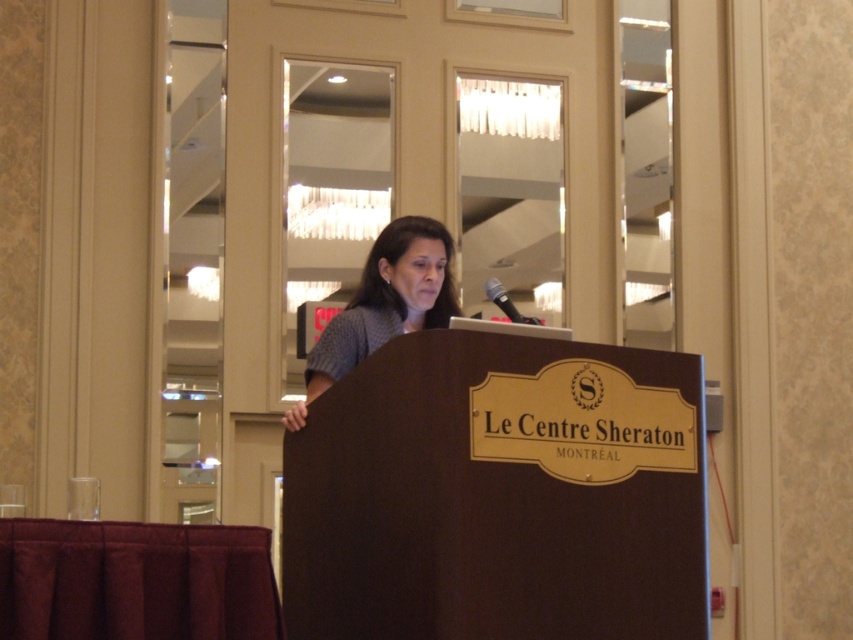
Is matte gray blouse at center shorter than black metallic microphone at center?

In fact, matte gray blouse at center may be taller than black metallic microphone at center.

I want to click on matte gray blouse at center, so click(384, 304).